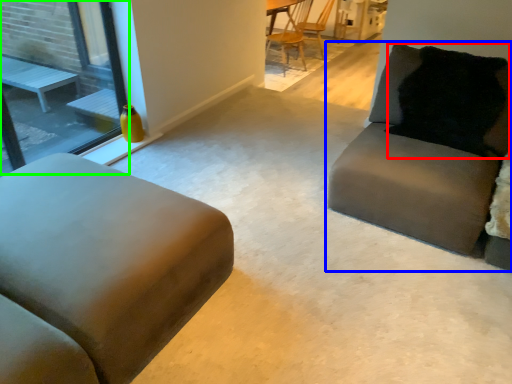
Question: Which object is the farthest from pillow (highlighted by a red box)? Choose among these: studio couch (highlighted by a blue box) or window (highlighted by a green box).

Choices:
 (A) studio couch
 (B) window

Answer: (B)